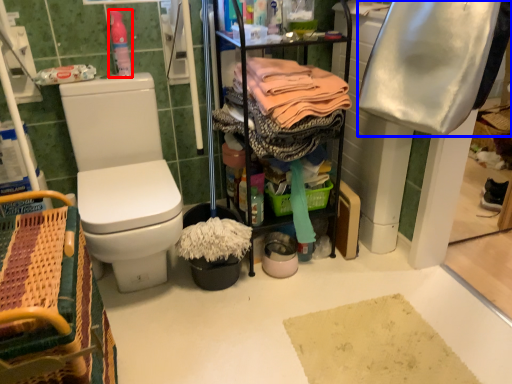
Question: Which point is further to the camera, cleaning products (highlighted by a red box) or clothing (highlighted by a blue box)?

Choices:
 (A) cleaning products
 (B) clothing

Answer: (A)